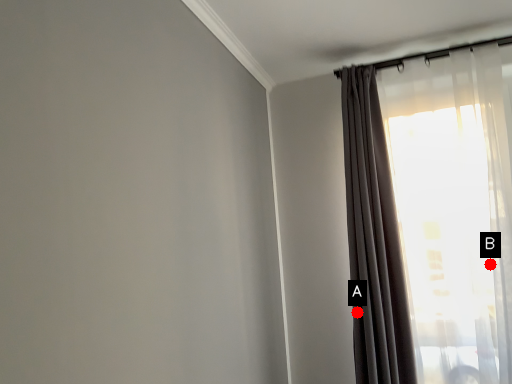
Question: Two points are circled on the image, labeled by A and B beside each circle. Which point is closer to the camera?

Choices:
 (A) A is closer
 (B) B is closer

Answer: (B)